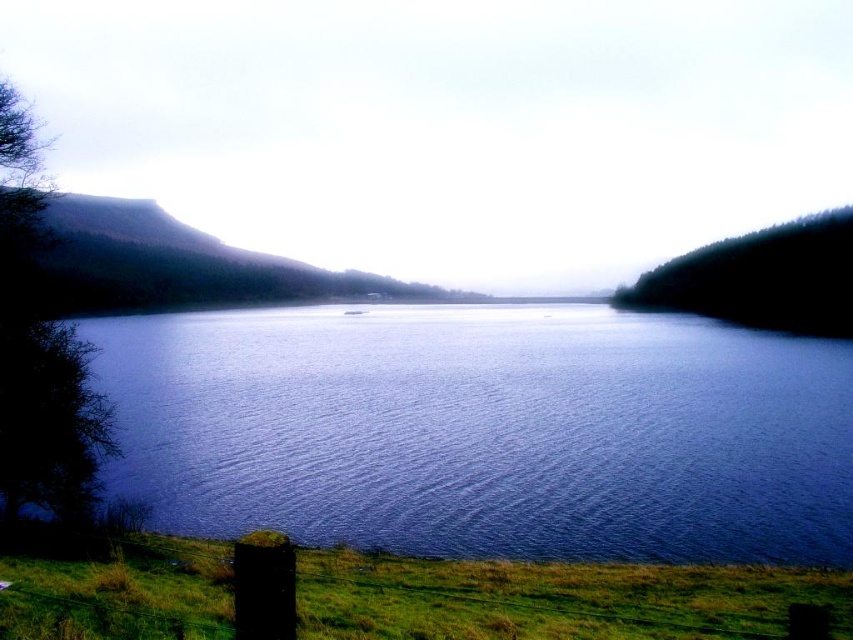
Question: Can you confirm if blue water at center is positioned above green grassy at lower left?

Choices:
 (A) yes
 (B) no

Answer: (A)

Question: Which of the following is the farthest from the observer?

Choices:
 (A) (486, 612)
 (B) (189, 500)

Answer: (B)

Question: Does blue water at center have a smaller size compared to green grassy at lower left?

Choices:
 (A) yes
 (B) no

Answer: (B)

Question: Is blue water at center above green grassy at lower left?

Choices:
 (A) yes
 (B) no

Answer: (A)

Question: Which of the following is the farthest from the observer?

Choices:
 (A) (207, 356)
 (B) (610, 628)

Answer: (A)